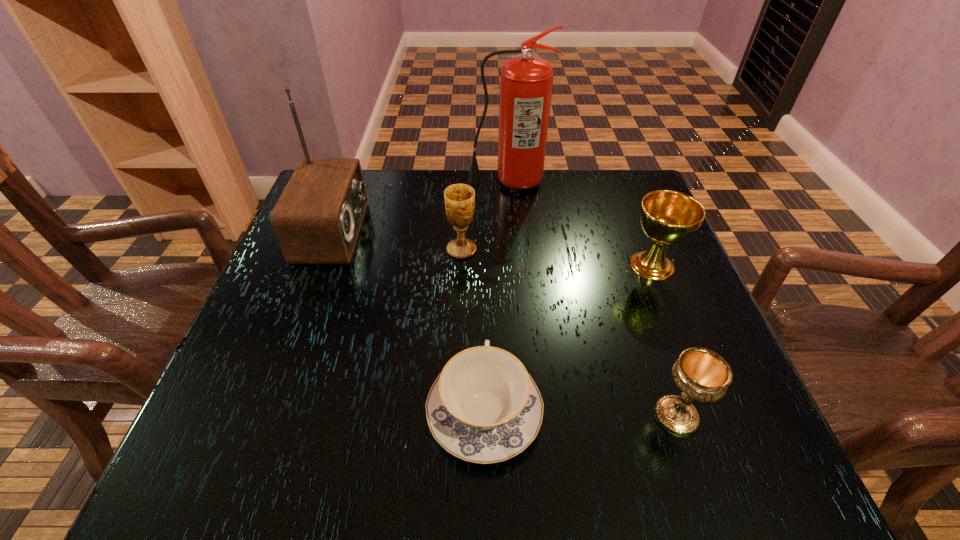
The image size is (960, 540). I want to click on object at the near right corner, so click(701, 374).

This screenshot has width=960, height=540. Identify the location of vacant position at the far edge of the desktop. (591, 212).

The image size is (960, 540). What are the coordinates of `free space at the near edge of the desktop` in the screenshot? It's located at (322, 480).

In the image, there is a desktop. At what (x,y) coordinates should I click in order to perform the action: click on vacant space at the left edge. Please return your answer as a coordinate pair (x, y). Looking at the image, I should click on (255, 312).

Where is `vacant space at the right edge of the desktop`? Image resolution: width=960 pixels, height=540 pixels. vacant space at the right edge of the desktop is located at coordinates (655, 294).

Find the location of a particular element. This screenshot has width=960, height=540. free spot at the far left corner of the desktop is located at coordinates (369, 168).

At what (x,y) coordinates should I click in order to perform the action: click on vacant area at the near right corner of the desktop. Please return your answer as a coordinate pair (x, y). Looking at the image, I should click on (746, 457).

Where is `empty space between the leftmost chalice and the farthest object`? This screenshot has height=540, width=960. empty space between the leftmost chalice and the farthest object is located at coordinates (485, 215).

Where is `free spot between the leftmost chalice and the fire extinguisher`? The height and width of the screenshot is (540, 960). free spot between the leftmost chalice and the fire extinguisher is located at coordinates (485, 215).

You are a GUI agent. You are given a task and a screenshot of the screen. Output one action in this format:
    pyautogui.click(x=<x>, y=<y>)
    Task: Click on the blank region between the leftmost chalice and the tallest object
    The image size is (960, 540).
    Given the screenshot: What is the action you would take?
    pyautogui.click(x=485, y=215)